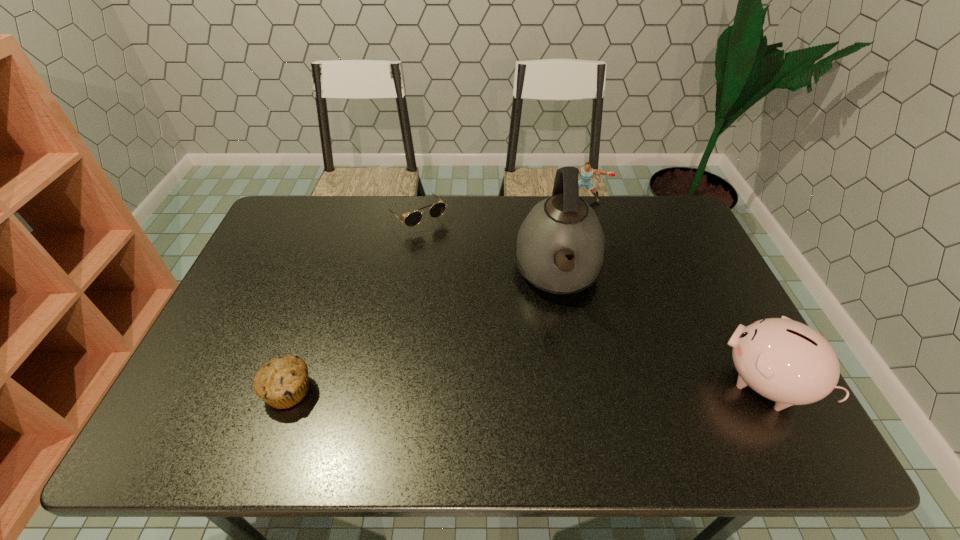
Find the location of a particular element. This screenshot has width=960, height=540. vacant spot on the desktop that is between the muffin and the fourth shortest object and is positioned on the front lenses of the fourth object from right to left is located at coordinates (572, 386).

Locate an element on the screen. Image resolution: width=960 pixels, height=540 pixels. vacant spot on the desktop that is between the muffin and the second tallest object and is positioned at the spout of the tallest object is located at coordinates (561, 386).

This screenshot has width=960, height=540. Identify the location of free spot on the desktop that is between the leftmost object and the second tallest object and is positioned on the front-facing side of the third shortest object. (585, 386).